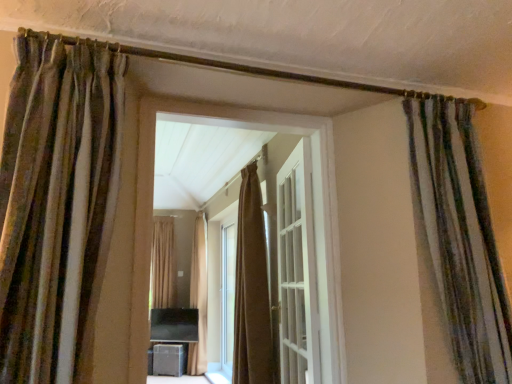
Question: In terms of width, does matte black speaker at lower center look wider or thinner when compared to brown velvet curtain at center, which is the 2th curtain from right to left?

Choices:
 (A) thin
 (B) wide

Answer: (A)

Question: Is matte black speaker at lower center situated inside brown velvet curtain at center, which is the 2th curtain from right to left, or outside?

Choices:
 (A) inside
 (B) outside

Answer: (B)

Question: Which object is the farthest from the striped fabric curtain at right, the 4th curtain when ordered from back to front?

Choices:
 (A) matte black speaker at lower center
 (B) white glossy door at center
 (C) brown textured curtain at center, the 5th curtain from the right
 (D) brown velvet curtain at center, acting as the 3th curtain starting from the back
 (E) beige fabric curtain at center, the 4th curtain from the front

Answer: (C)

Question: Estimate the real-world distances between objects in this image. Which object is farther from the brown textured curtain at center, marked as the first curtain in a left-to-right arrangement?

Choices:
 (A) matte black speaker at lower center
 (B) beige fabric curtain at center, which is counted as the 2th curtain, starting from the back
 (C) striped fabric curtain at right, which ranks as the 1th curtain in right-to-left order
 (D) white glossy door at center
 (E) brown textured curtain at left, positioned as the 1th curtain in front-to-back order

Answer: (E)